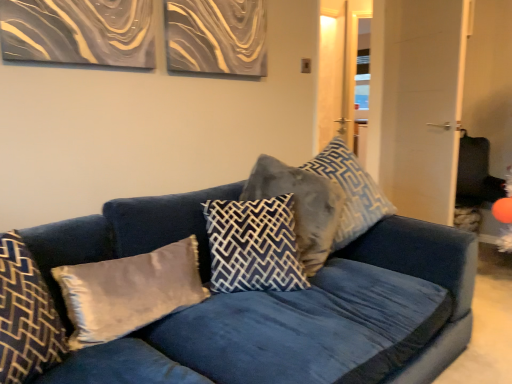
Question: Is velvet blue pillow at center, the first pillow positioned from the right, looking in the opposite direction of velvet blue couch at center?

Choices:
 (A) no
 (B) yes

Answer: (B)

Question: From a real-world perspective, is velvet blue pillow at center, acting as the 5th pillow starting from the left, beneath velvet blue couch at center?

Choices:
 (A) yes
 (B) no

Answer: (B)

Question: Does velvet blue pillow at center, the first pillow positioned from the right, have a lesser width compared to velvet blue couch at center?

Choices:
 (A) yes
 (B) no

Answer: (A)

Question: Is velvet blue pillow at center, the first pillow positioned from the right, in front of velvet blue couch at center?

Choices:
 (A) yes
 (B) no

Answer: (B)

Question: Would you say velvet blue pillow at center, the first pillow positioned from the right, is outside velvet blue couch at center?

Choices:
 (A) yes
 (B) no

Answer: (B)

Question: Is dark blue velvet pillow at center, which is the third pillow in left-to-right order, situated inside velvet gray pillow at left, acting as the 1th pillow starting from the left, or outside?

Choices:
 (A) inside
 (B) outside

Answer: (B)

Question: Based on their positions, is dark blue velvet pillow at center, which is the third pillow in left-to-right order, located to the left or right of velvet gray pillow at left, the fifth pillow when ordered from right to left?

Choices:
 (A) right
 (B) left

Answer: (A)

Question: In terms of size, does dark blue velvet pillow at center, which is the third pillow in left-to-right order, appear bigger or smaller than velvet gray pillow at left, the fifth pillow when ordered from right to left?

Choices:
 (A) big
 (B) small

Answer: (A)

Question: Considering their positions, is dark blue velvet pillow at center, the 3th pillow in the right-to-left sequence, located in front of or behind velvet gray pillow at left, acting as the 1th pillow starting from the left?

Choices:
 (A) behind
 (B) front

Answer: (A)

Question: From a real-world perspective, relative to velvet gray pillow at left, acting as the 1th pillow starting from the left, is velvet blue couch at center vertically above or below?

Choices:
 (A) above
 (B) below

Answer: (B)

Question: Based on their sizes in the image, would you say velvet blue couch at center is bigger or smaller than velvet gray pillow at left, acting as the 1th pillow starting from the left?

Choices:
 (A) big
 (B) small

Answer: (A)

Question: Is velvet blue couch at center in front of or behind velvet gray pillow at left, the fifth pillow when ordered from right to left, in the image?

Choices:
 (A) front
 (B) behind

Answer: (A)

Question: Is point (258, 317) positioned closer to the camera than point (44, 331)?

Choices:
 (A) farther
 (B) closer

Answer: (A)

Question: Relative to dark blue velvet pillow at center, which is the third pillow in left-to-right order, is velvet blue couch at center in front or behind?

Choices:
 (A) front
 (B) behind

Answer: (A)

Question: Looking at the image, does velvet blue couch at center seem bigger or smaller compared to dark blue velvet pillow at center, which is the third pillow in left-to-right order?

Choices:
 (A) small
 (B) big

Answer: (B)